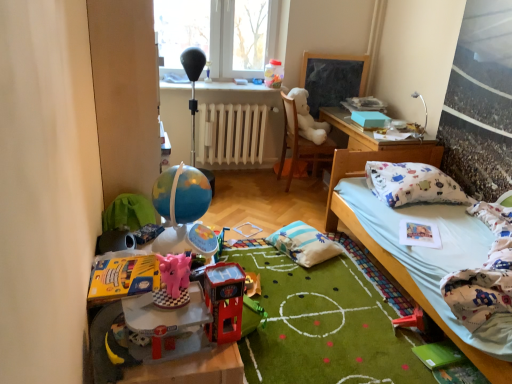
In order to click on free space in front of shiny plastic toy car at center, which is counted as the third toy, starting from the top in this screenshot , I will do `click(210, 365)`.